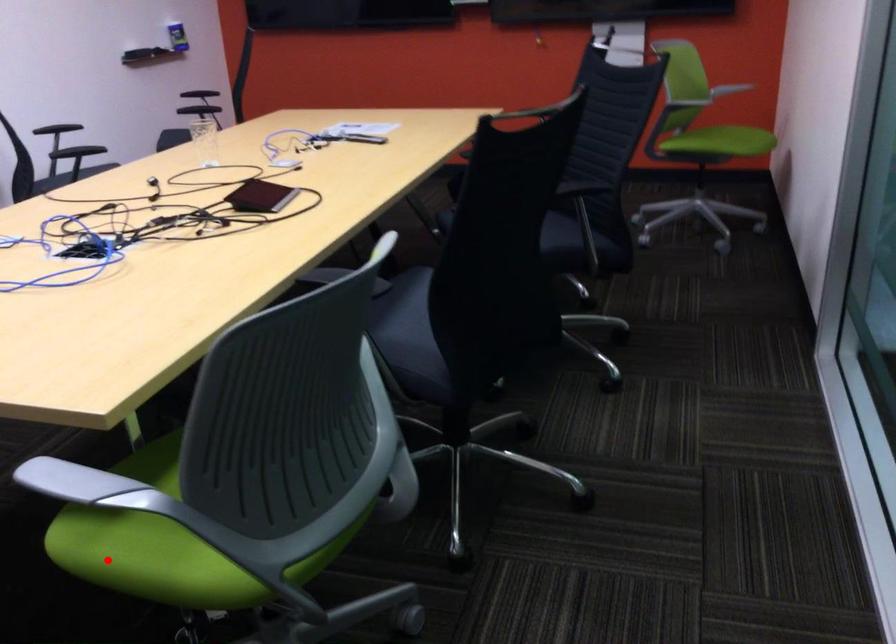
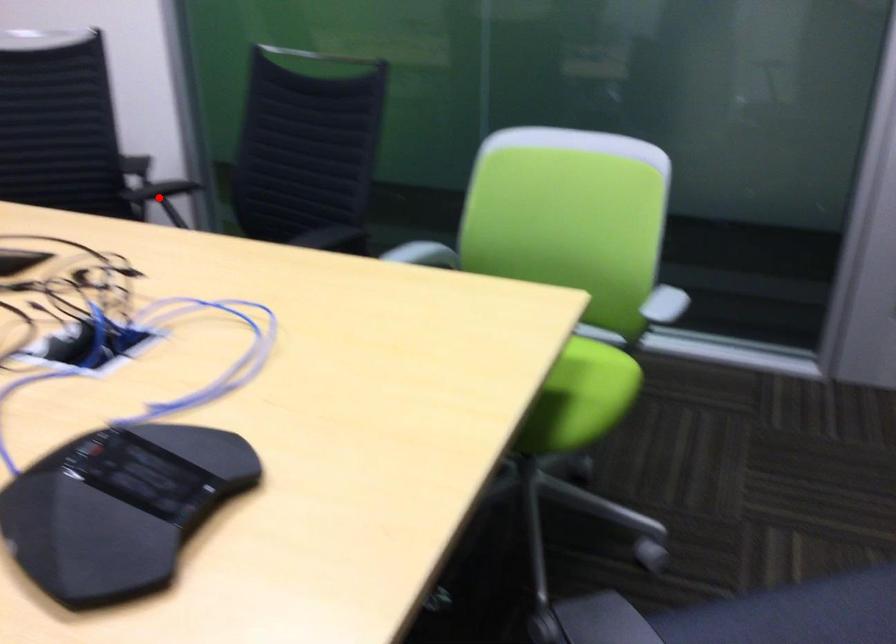
I am providing you with two images of the same scene from different viewpoints. A red point is marked on the first image and another point is marked on the second image. Is the marked point in image1 the same physical position as the marked point in image2?

No